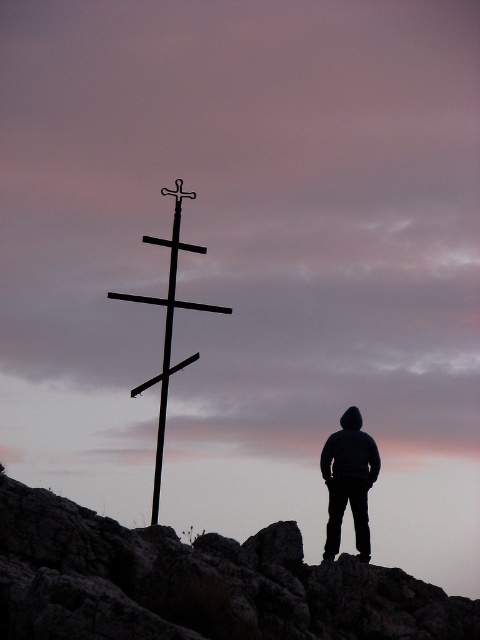
Question: Can you confirm if black matte hoodie at lower right is positioned to the right of black metal cross at center?

Choices:
 (A) no
 (B) yes

Answer: (B)

Question: Does rugged stone rock at center appear under black matte hoodie at lower right?

Choices:
 (A) yes
 (B) no

Answer: (A)

Question: Is black matte hoodie at lower right bigger than black metal cross at center?

Choices:
 (A) yes
 (B) no

Answer: (B)

Question: Which is nearer to the black metal cross at center?

Choices:
 (A) rugged stone rock at center
 (B) black matte hoodie at lower right

Answer: (B)

Question: Which point appears closest to the camera in this image?

Choices:
 (A) (149, 237)
 (B) (243, 600)
 (C) (342, 467)

Answer: (B)

Question: Which object is the closest to the black matte hoodie at lower right?

Choices:
 (A) rugged stone rock at center
 (B) black metal cross at center

Answer: (B)